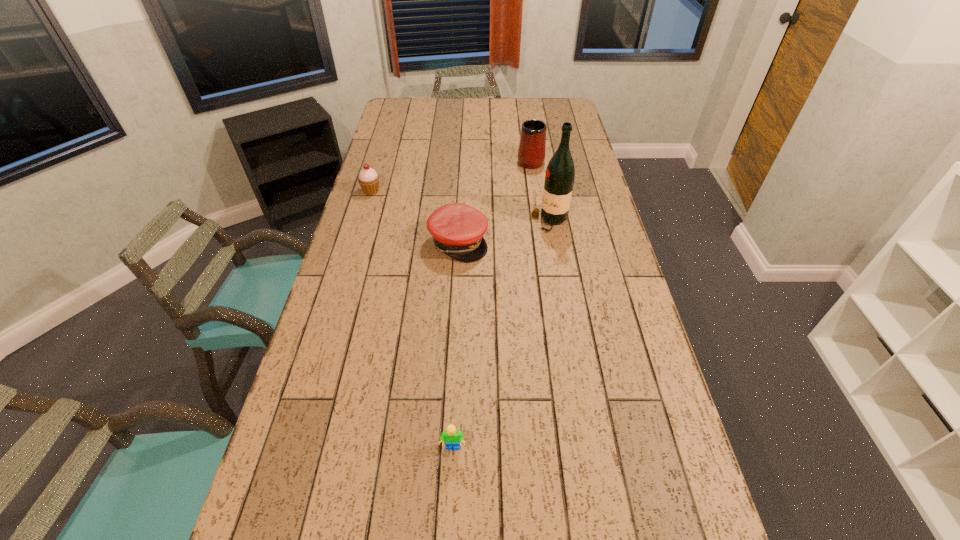
What are the coordinates of `vacant space at the far right corner of the desktop` in the screenshot? It's located at (555, 111).

Where is `free spot between the second tallest object and the nearest object`? free spot between the second tallest object and the nearest object is located at coordinates (492, 303).

The height and width of the screenshot is (540, 960). What are the coordinates of `free point between the wine bottle and the cap` in the screenshot? It's located at (504, 232).

I want to click on unoccupied position between the wine bottle and the cap, so click(x=504, y=232).

The height and width of the screenshot is (540, 960). In order to click on vacant space in between the nearest object and the mug in this screenshot , I will do `click(492, 303)`.

Image resolution: width=960 pixels, height=540 pixels. I want to click on vacant area that lies between the wine bottle and the cap, so click(x=504, y=232).

The width and height of the screenshot is (960, 540). I want to click on vacant space in between the farthest object and the nearest object, so click(492, 303).

Find the location of a particular element. free space between the fourth shortest object and the cap is located at coordinates (494, 201).

Find the location of a particular element. The image size is (960, 540). vacant region between the Lego and the wine bottle is located at coordinates (501, 334).

What are the coordinates of `unoccupied area between the nearest object and the cap` in the screenshot? It's located at (455, 345).